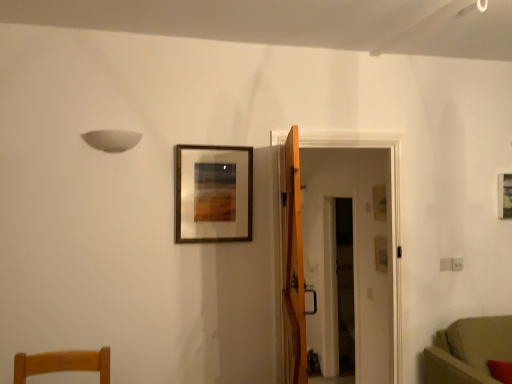
Question: Is wooden picture frame at upper right, which is the 2th picture frame in back-to-front order, in front of or behind wooden-framed artwork at center, placed as the third picture frame when sorted from back to front, in the image?

Choices:
 (A) behind
 (B) front

Answer: (A)

Question: Based on their positions, is wooden picture frame at upper right, the 2th picture frame when ordered from front to back, located to the left or right of wooden-framed artwork at center, placed as the third picture frame when sorted from back to front?

Choices:
 (A) right
 (B) left

Answer: (A)

Question: Which of these objects is positioned farthest from the suede-like beige sofa at lower right?

Choices:
 (A) transparent glass door at center
 (B) wooden-framed artwork at center, placed as the third picture frame when sorted from back to front
 (C) wooden door at center
 (D) matte gold picture frame at upper right, the second picture frame viewed from the right
 (E) wooden picture frame at upper right, acting as the first picture frame starting from the right

Answer: (A)

Question: Estimate the real-world distances between objects in this image. Which object is closer to the wooden-framed artwork at center, acting as the first picture frame starting from the left?

Choices:
 (A) suede-like beige sofa at lower right
 (B) wooden door at center
 (C) wooden picture frame at upper right, the 2th picture frame when ordered from front to back
 (D) matte gold picture frame at upper right, placed as the third picture frame when sorted from front to back
 (E) transparent glass door at center

Answer: (B)